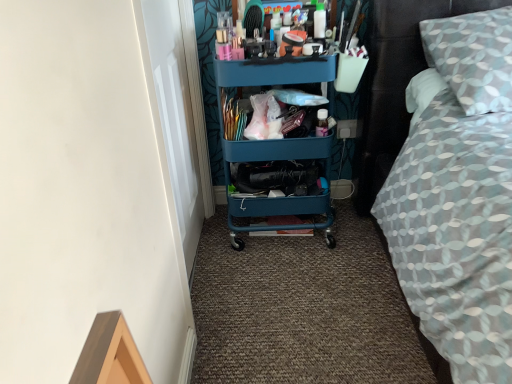
Question: Should I look upward or downward to see patterned fabric bed at right?

Choices:
 (A) down
 (B) up

Answer: (B)

Question: Is teal plastic cart at center shorter than patterned fabric bed at right?

Choices:
 (A) yes
 (B) no

Answer: (B)

Question: From the image's perspective, is teal plastic cart at center on patterned fabric bed at right?

Choices:
 (A) yes
 (B) no

Answer: (B)

Question: Is teal plastic cart at center oriented away from patterned fabric bed at right?

Choices:
 (A) no
 (B) yes

Answer: (A)

Question: From a real-world perspective, is teal plastic cart at center physically above patterned fabric bed at right?

Choices:
 (A) no
 (B) yes

Answer: (A)

Question: Considering the relative sizes of teal plastic cart at center and patterned fabric bed at right in the image provided, is teal plastic cart at center wider than patterned fabric bed at right?

Choices:
 (A) no
 (B) yes

Answer: (A)

Question: Does teal plastic cart at center have a smaller size compared to patterned fabric bed at right?

Choices:
 (A) no
 (B) yes

Answer: (B)

Question: Is patterned fabric bed at right completely or partially outside of teal plastic cart at center?

Choices:
 (A) yes
 (B) no

Answer: (A)

Question: Does patterned fabric bed at right have a lesser width compared to teal plastic cart at center?

Choices:
 (A) no
 (B) yes

Answer: (A)

Question: Are patterned fabric bed at right and teal plastic cart at center far apart?

Choices:
 (A) no
 (B) yes

Answer: (A)

Question: Is patterned fabric bed at right looking in the opposite direction of teal plastic cart at center?

Choices:
 (A) no
 (B) yes

Answer: (A)

Question: Could you tell me if patterned fabric bed at right is facing teal plastic cart at center?

Choices:
 (A) no
 (B) yes

Answer: (A)

Question: From the image's perspective, does patterned fabric bed at right appear lower than teal plastic cart at center?

Choices:
 (A) no
 (B) yes

Answer: (A)

Question: In the image, is patterned fabric bed at right positioned in front of or behind teal plastic cart at center?

Choices:
 (A) front
 (B) behind

Answer: (A)